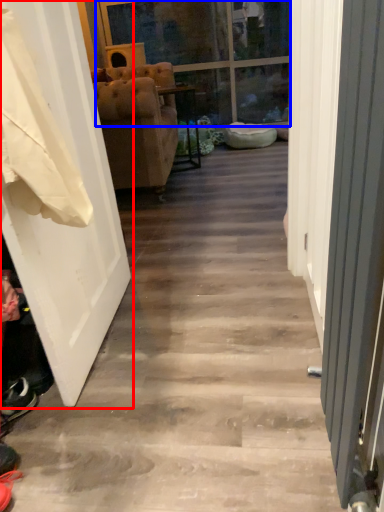
Question: Which point is closer to the camera, door (highlighted by a red box) or glass door (highlighted by a blue box)?

Choices:
 (A) door
 (B) glass door

Answer: (A)